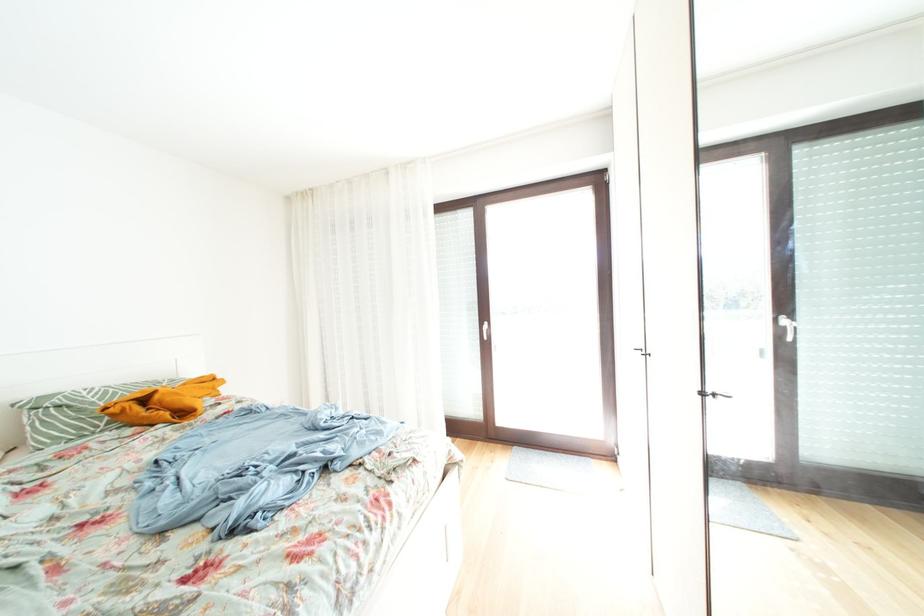
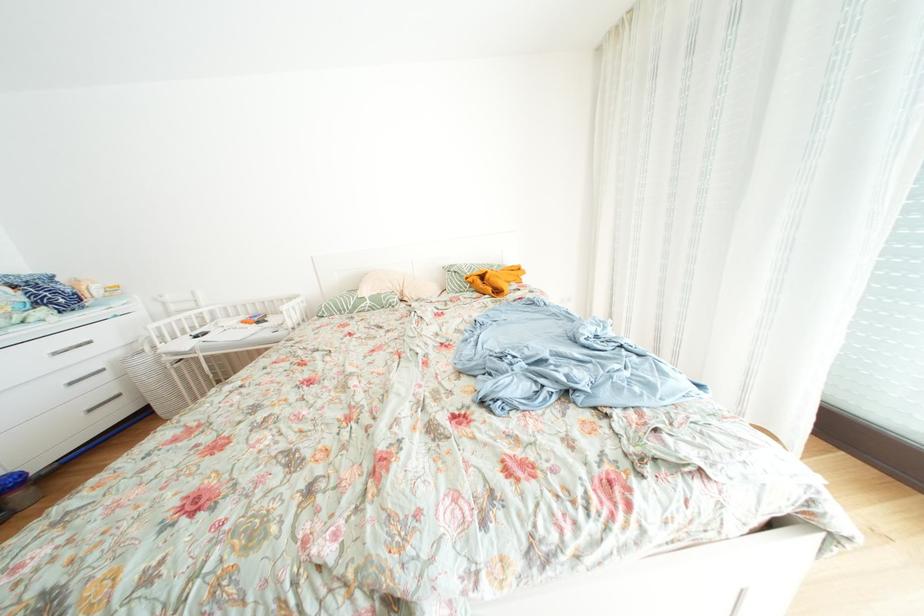
In the scene shown: The first image is from the beginning of the video and the second image is from the end. How did the camera likely rotate when shooting the video?

The camera's rotation is toward left-down.